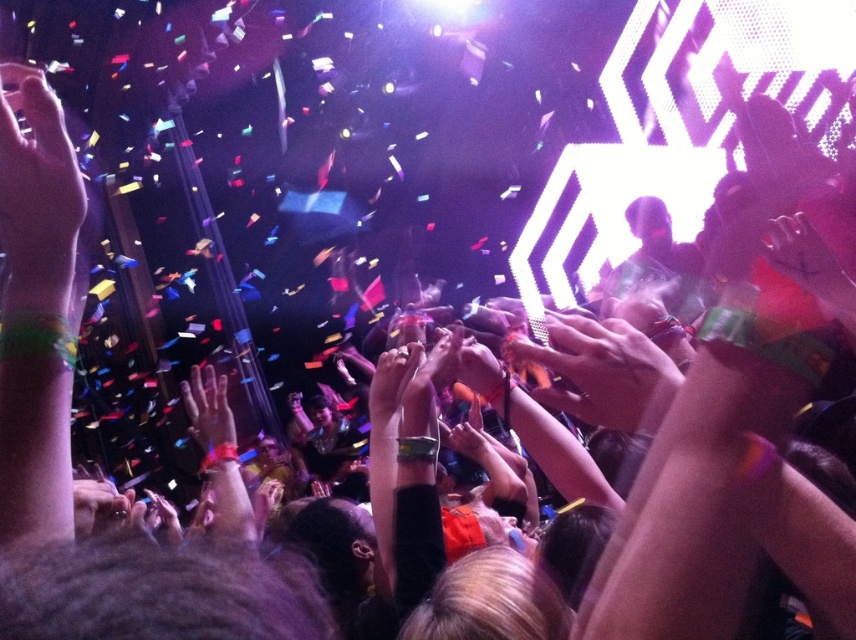
Question: Is matte skin hand at upper left bigger than matte skin hand at center?

Choices:
 (A) yes
 (B) no

Answer: (A)

Question: Which point is farther to the camera?

Choices:
 (A) matte skin hand at center
 (B) matte skin hand at upper left

Answer: (A)

Question: Can you confirm if matte skin hand at upper left is thinner than matte skin hand at center?

Choices:
 (A) yes
 (B) no

Answer: (A)

Question: Is matte skin hand at upper left below matte skin hand at center?

Choices:
 (A) yes
 (B) no

Answer: (B)

Question: Which of the following is the closest to the observer?

Choices:
 (A) (49, 93)
 (B) (206, 385)

Answer: (A)